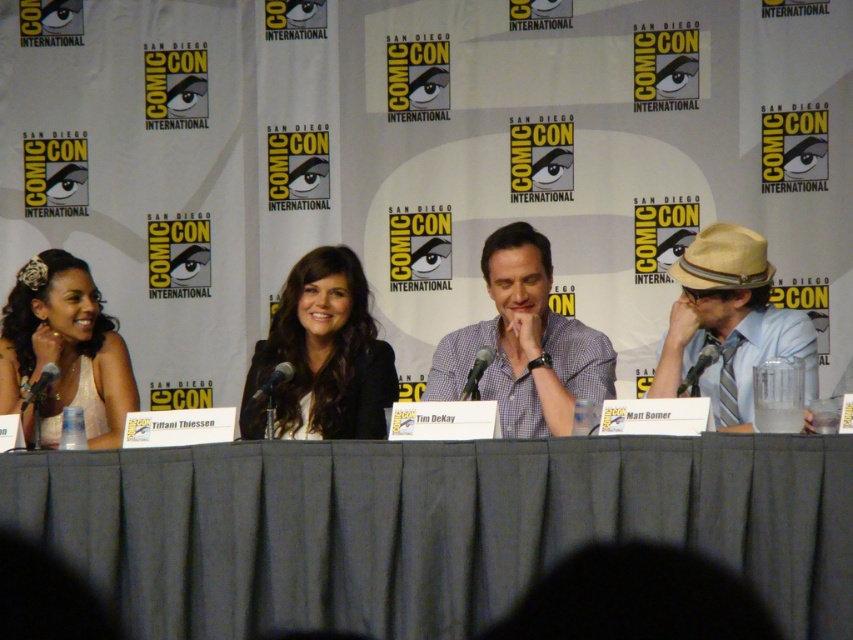
Question: Does checkered fabric shirt at center have a lesser width compared to white satin dress at left?

Choices:
 (A) yes
 (B) no

Answer: (B)

Question: Is black matte blazer at center wider than white satin dress at left?

Choices:
 (A) no
 (B) yes

Answer: (A)

Question: Does gray fabric table at center have a larger size compared to black matte blazer at center?

Choices:
 (A) no
 (B) yes

Answer: (B)

Question: Among these objects, which one is farthest from the camera?

Choices:
 (A) tan straw hat at right
 (B) gray fabric table at center
 (C) black matte blazer at center
 (D) checkered fabric shirt at center

Answer: (C)

Question: Which object appears closest to the camera in this image?

Choices:
 (A) checkered fabric shirt at center
 (B) gray fabric table at center
 (C) white satin dress at left
 (D) black matte blazer at center

Answer: (B)

Question: Which point appears farthest from the camera in this image?

Choices:
 (A) pos(427,596)
 (B) pos(729,403)

Answer: (B)